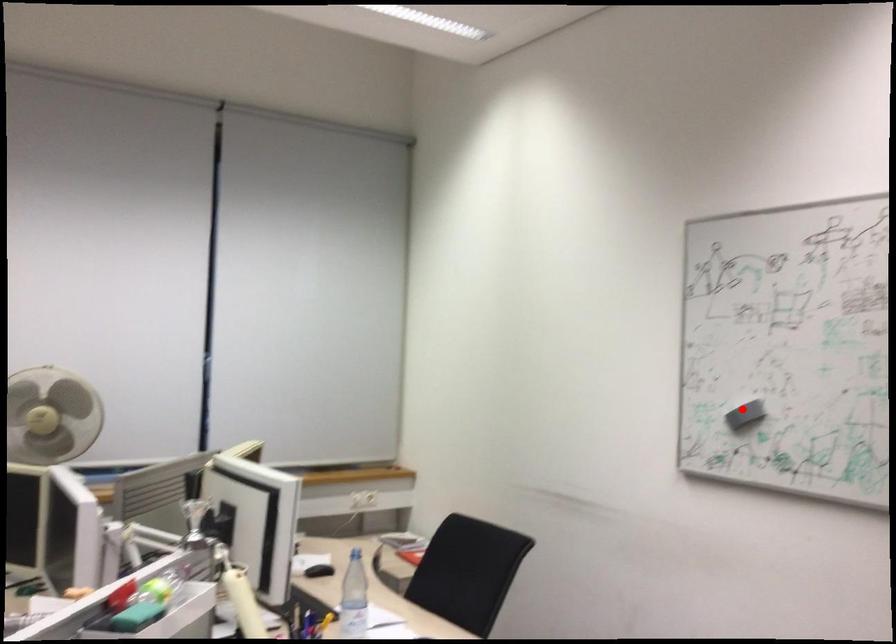
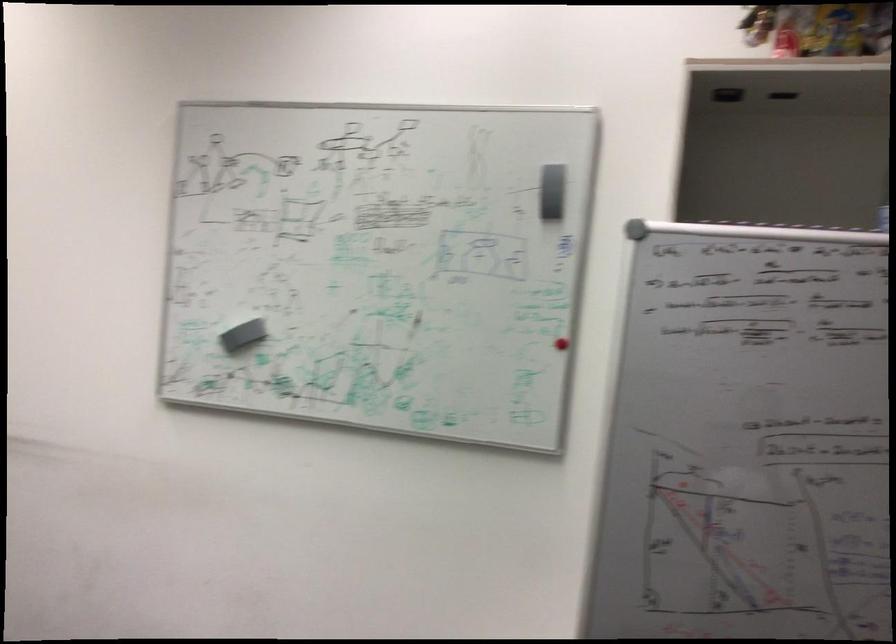
Question: I am providing you with two images of the same scene from different viewpoints. A red point is marked on the first image. Is the red point's position out of view in image 2?

Choices:
 (A) Yes
 (B) No

Answer: (B)